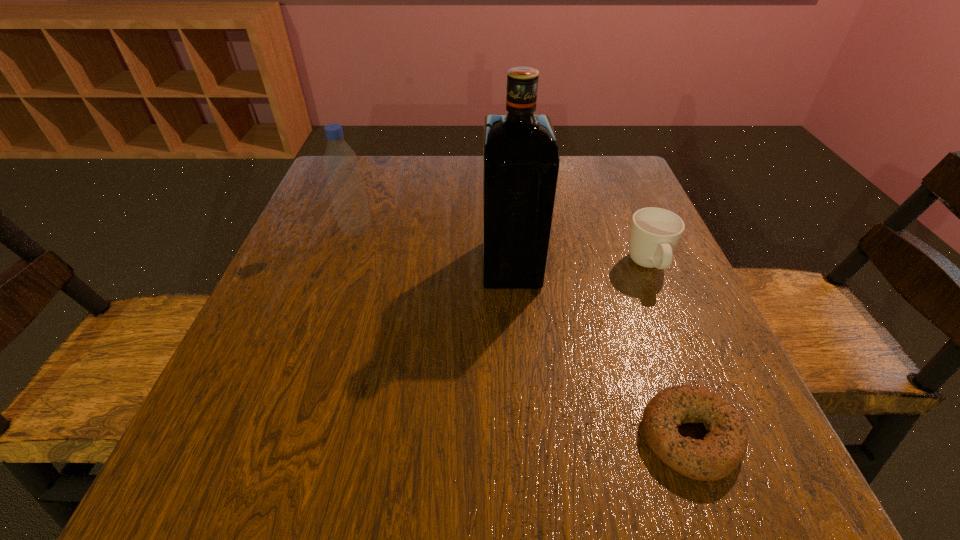
The width and height of the screenshot is (960, 540). I want to click on free point between the nearest object and the tallest object, so click(601, 350).

The height and width of the screenshot is (540, 960). I want to click on free space between the liquor and the leftmost object, so click(434, 247).

You are a GUI agent. You are given a task and a screenshot of the screen. Output one action in this format:
    pyautogui.click(x=<x>, y=<y>)
    Task: Click on the free spot between the leftmost object and the nearest object
    
    Given the screenshot: What is the action you would take?
    pyautogui.click(x=523, y=333)

Locate an element on the screen. This screenshot has height=540, width=960. vacant area between the second shortest object and the tallest object is located at coordinates (580, 266).

Locate an element on the screen. This screenshot has width=960, height=540. free spot between the cup and the nearest object is located at coordinates (669, 352).

Identify the location of object that stands as the third closest to the liquor. Image resolution: width=960 pixels, height=540 pixels. (721, 451).

Choose which object is the second nearest neighbor to the liquor. Please provide its 2D coordinates. Your answer should be formatted as a tuple, i.e. [(x, y)], where the tuple contains the x and y coordinates of a point satisfying the conditions above.

[(341, 165)]

You are a GUI agent. You are given a task and a screenshot of the screen. Output one action in this format:
    pyautogui.click(x=<x>, y=<y>)
    Task: Click on the free location that satisfies the following two spatial constraints: 1. on the back side of the nearest object; 2. on the front label of the third object from right to left
    The width and height of the screenshot is (960, 540).
    Given the screenshot: What is the action you would take?
    pyautogui.click(x=627, y=265)